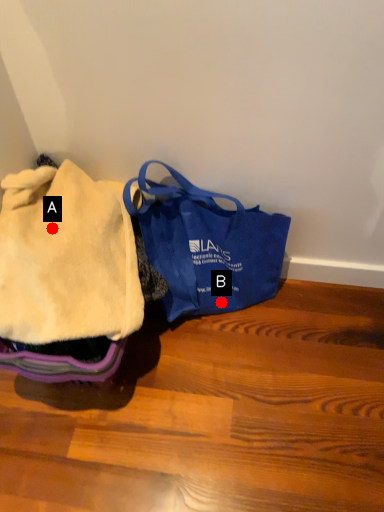
Question: Two points are circled on the image, labeled by A and B beside each circle. Which point is closer to the camera taking this photo?

Choices:
 (A) A is closer
 (B) B is closer

Answer: (A)